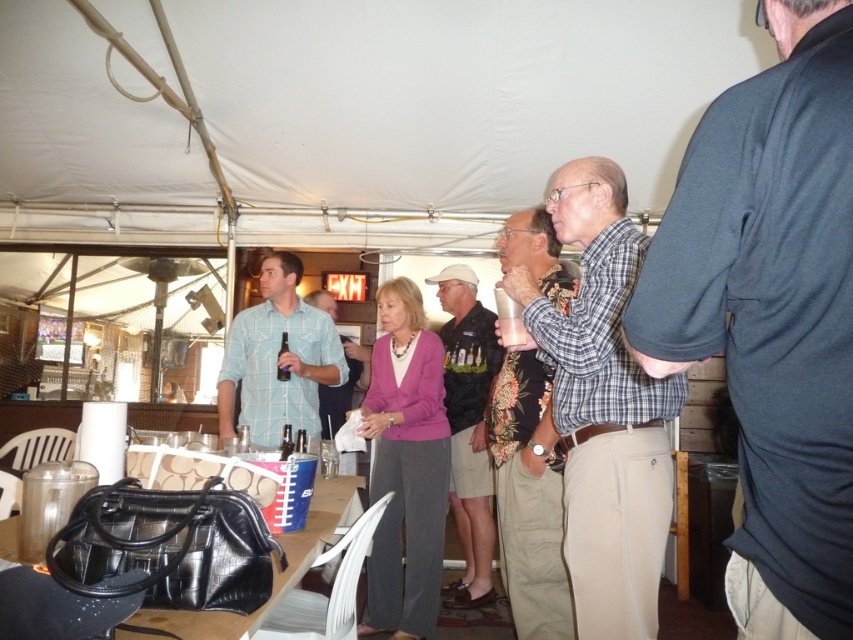
Does plaid shirt at center appear on the left side of light blue plaid shirt at center?

In fact, plaid shirt at center is to the right of light blue plaid shirt at center.

Is plaid shirt at center smaller than light blue plaid shirt at center?

Yes.

Is point (538, 326) positioned after point (242, 364)?

No, (538, 326) is closer to viewer.

The height and width of the screenshot is (640, 853). Identify the location of plaid shirt at center. (602, 408).

Which is above, light blue plaid shirt at center or dark gray cotton shirt at center?

Positioned higher is light blue plaid shirt at center.

Is light blue plaid shirt at center wider than dark gray cotton shirt at center?

Yes.

This screenshot has width=853, height=640. Identify the location of light blue plaid shirt at center. point(277,358).

Identify the location of plaid shirt at center. (602, 408).

How much distance is there between plaid shirt at center and floral fabric shirt at center?

A distance of 10.13 inches exists between plaid shirt at center and floral fabric shirt at center.

This screenshot has width=853, height=640. In order to click on plaid shirt at center in this screenshot , I will do `click(602, 408)`.